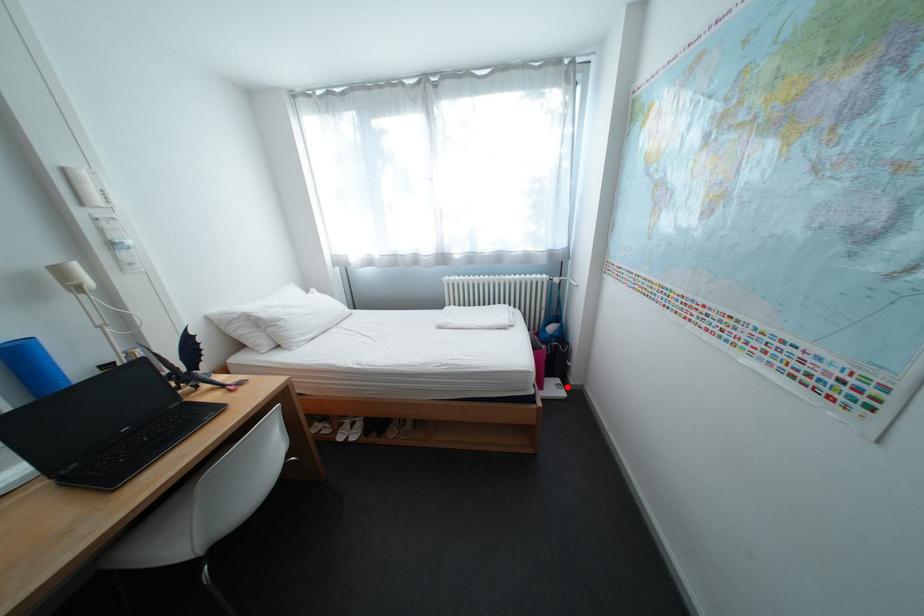
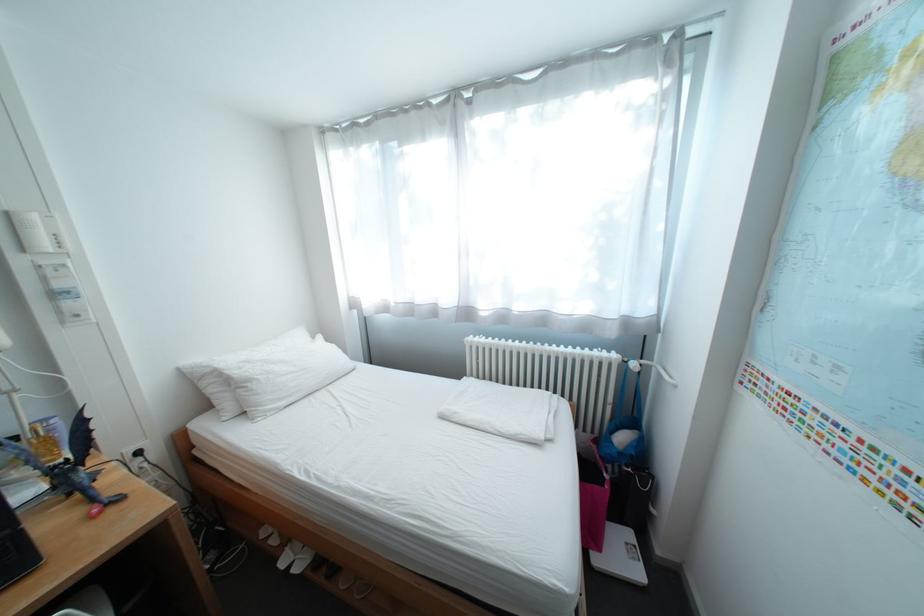
In the second image, find the point that corresponds to the highlighted location in the first image.

(637, 548)